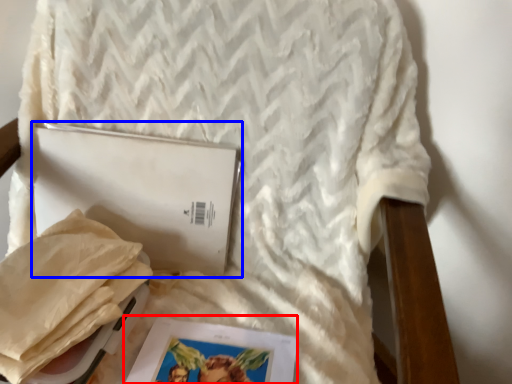
Question: Which object is further to the camera taking this photo, magazine (highlighted by a red box) or journal (highlighted by a blue box)?

Choices:
 (A) magazine
 (B) journal

Answer: (B)